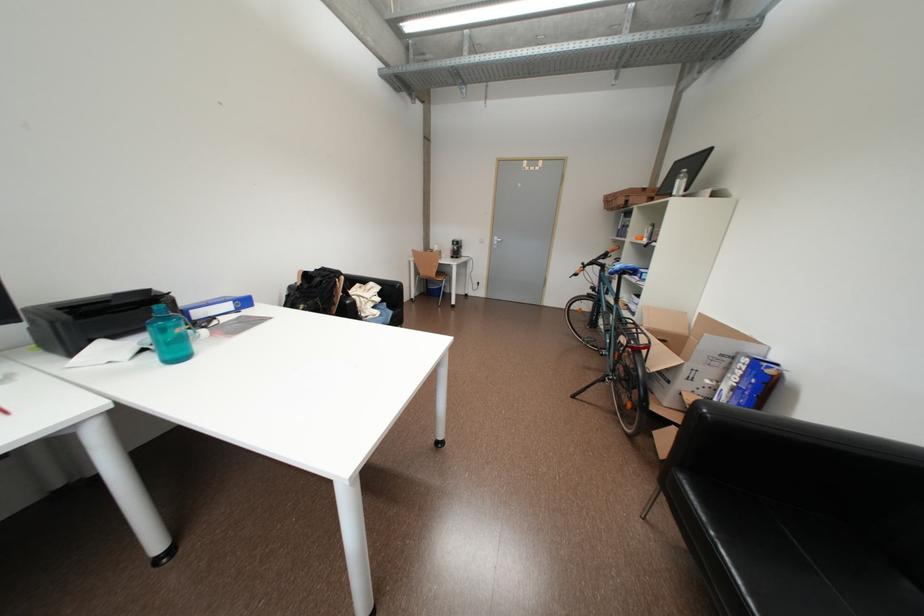
Find where to rest the sofa armrest. Please return your answer as a coordinate pair (x, y).

(816, 431)